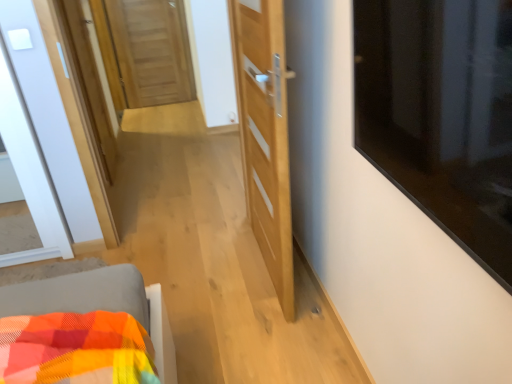
At what (x,y) coordinates should I click in order to perform the action: click on wooden door at center, positioned as the 2th door in bottom-to-top order. Please return your answer as a coordinate pair (x, y). The width and height of the screenshot is (512, 384). Looking at the image, I should click on (151, 51).

From a real-world perspective, is transparent glass window at upper right located higher than wooden door at center, positioned as the 2th door in bottom-to-top order?

Yes, from a real-world perspective, transparent glass window at upper right is on top of wooden door at center, positioned as the 2th door in bottom-to-top order.

Which is more to the right, transparent glass window at upper right or wooden door at center, positioned as the 2th door in bottom-to-top order?

From the viewer's perspective, transparent glass window at upper right appears more on the right side.

Is transparent glass window at upper right oriented towards wooden door at center, positioned as the 2th door in bottom-to-top order?

No, transparent glass window at upper right is not oriented towards wooden door at center, positioned as the 2th door in bottom-to-top order.

Does point (457, 234) appear closer or farther from the camera than point (288, 287)?

Point (457, 234) is positioned closer to the camera compared to point (288, 287).

I want to click on door that is the 1st object directly below the transparent glass window at upper right (from a real-world perspective), so click(265, 134).

Does transparent glass window at upper right have a greater height compared to light wood door at center, which is the second door in top-to-bottom order?

No.

Which is in front, transparent glass window at upper right or light wood door at center, which is the second door in top-to-bottom order?

transparent glass window at upper right is in front.

Between wooden door at center, which is counted as the 1th door, starting from the top, and transparent glass window at upper right, which one has smaller width?

With smaller width is wooden door at center, which is counted as the 1th door, starting from the top.

Would you say wooden door at center, positioned as the 2th door in bottom-to-top order, contains transparent glass window at upper right?

No, transparent glass window at upper right is located outside of wooden door at center, positioned as the 2th door in bottom-to-top order.

Can you tell me how much wooden door at center, positioned as the 2th door in bottom-to-top order, and transparent glass window at upper right differ in facing direction?

They differ by 92.2 degrees in their facing directions.

Is wooden door at center, which is counted as the 1th door, starting from the top, to the left of transparent glass window at upper right from the viewer's perspective?

Indeed, wooden door at center, which is counted as the 1th door, starting from the top, is positioned on the left side of transparent glass window at upper right.

Who is smaller, light wood door at center, arranged as the first door when ordered from the bottom, or transparent glass window at upper right?

With smaller size is transparent glass window at upper right.

Considering the positions of objects light wood door at center, arranged as the first door when ordered from the bottom, and transparent glass window at upper right in the image provided, who is in front, light wood door at center, arranged as the first door when ordered from the bottom, or transparent glass window at upper right?

Positioned in front is transparent glass window at upper right.

Is light wood door at center, which appears as the 2th door when viewed from the back, at the right side of transparent glass window at upper right?

No.

Is wooden door at center, which is counted as the 1th door, starting from the top, next to light wood door at center, the 1th door viewed from the front, and touching it?

No, wooden door at center, which is counted as the 1th door, starting from the top, is not making contact with light wood door at center, the 1th door viewed from the front.

Does wooden door at center, which is counted as the 1th door, starting from the top, have a lesser width compared to light wood door at center, which appears as the 2th door when viewed from the back?

No, wooden door at center, which is counted as the 1th door, starting from the top, is not thinner than light wood door at center, which appears as the 2th door when viewed from the back.

Do you think wooden door at center, which appears as the second door when viewed from the front, is within light wood door at center, the 2th door positioned from the left, or outside of it?

wooden door at center, which appears as the second door when viewed from the front, lies outside light wood door at center, the 2th door positioned from the left.

Is wooden door at center, the second door positioned from the right, facing towards light wood door at center, arranged as the first door when ordered from the bottom?

Yes, wooden door at center, the second door positioned from the right, faces towards light wood door at center, arranged as the first door when ordered from the bottom.

Can you confirm if light wood door at center, which is the second door in top-to-bottom order, is positioned to the right of wooden door at center, the 1th door in the left-to-right sequence?

Yes.

Is light wood door at center, which appears as the 2th door when viewed from the back, smaller than wooden door at center, positioned as the 2th door in bottom-to-top order?

Correct, light wood door at center, which appears as the 2th door when viewed from the back, occupies less space than wooden door at center, positioned as the 2th door in bottom-to-top order.

Which object is wider, light wood door at center, the 2th door positioned from the left, or wooden door at center, marked as the first door in a back-to-front arrangement?

With larger width is wooden door at center, marked as the first door in a back-to-front arrangement.

Can you tell me how much light wood door at center, arranged as the first door when ordered from the bottom, and wooden door at center, positioned as the 2th door in bottom-to-top order, differ in facing direction?

91.3 degrees separate the facing orientations of light wood door at center, arranged as the first door when ordered from the bottom, and wooden door at center, positioned as the 2th door in bottom-to-top order.

Find the location of a particular element. This screenshot has width=512, height=384. window below the wooden door at center, the 1th door in the left-to-right sequence (from the image's perspective) is located at coordinates (442, 114).

This screenshot has height=384, width=512. Find the location of `the 1st door located beneath the transparent glass window at upper right (from a real-world perspective)`. the 1st door located beneath the transparent glass window at upper right (from a real-world perspective) is located at coordinates (265, 134).

Looking at the image, which one is located further to transparent glass window at upper right, wooden door at center, positioned as the 2th door in bottom-to-top order, or light wood door at center, arranged as the first door when ordered from the bottom?

wooden door at center, positioned as the 2th door in bottom-to-top order, lies further to transparent glass window at upper right than the other object.

Looking at the image, which one is located closer to transparent glass window at upper right, light wood door at center, arranged as the first door when ordered from the bottom, or wooden door at center, the 1th door in the left-to-right sequence?

light wood door at center, arranged as the first door when ordered from the bottom, is closer to transparent glass window at upper right.

Consider the image. Considering their positions, is wooden door at center, which appears as the second door when viewed from the front, positioned closer to light wood door at center, which appears as the 2th door when viewed from the back, than transparent glass window at upper right?

Based on the image, transparent glass window at upper right appears to be nearer to light wood door at center, which appears as the 2th door when viewed from the back.

From the picture: Estimate the real-world distances between objects in this image. Which object is closer to wooden door at center, marked as the first door in a back-to-front arrangement, transparent glass window at upper right or light wood door at center, the 1th door viewed from the front?

light wood door at center, the 1th door viewed from the front, lies closer to wooden door at center, marked as the first door in a back-to-front arrangement, than the other object.

Considering their positions, is light wood door at center, which is the second door in top-to-bottom order, positioned further to wooden door at center, which appears as the second door when viewed from the front, than transparent glass window at upper right?

transparent glass window at upper right is positioned further to the anchor wooden door at center, which appears as the second door when viewed from the front.

Which object lies nearer to the anchor point light wood door at center, the 2th door positioned from the left, transparent glass window at upper right or wooden door at center, the second door positioned from the right?

The object closer to light wood door at center, the 2th door positioned from the left, is transparent glass window at upper right.

You are a GUI agent. You are given a task and a screenshot of the screen. Output one action in this format:
    pyautogui.click(x=<x>, y=<y>)
    Task: Click on the door positioned between transparent glass window at upper right and wooden door at center, the 1th door in the left-to-right sequence, from near to far
    The width and height of the screenshot is (512, 384).
    Given the screenshot: What is the action you would take?
    pyautogui.click(x=265, y=134)